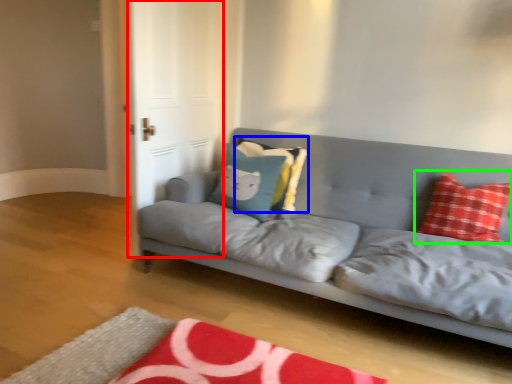
Question: Which object is the closest to the glass door (highlighted by a red box)? Choose among these: pillow (highlighted by a blue box) or pillow (highlighted by a green box).

Choices:
 (A) pillow
 (B) pillow

Answer: (A)